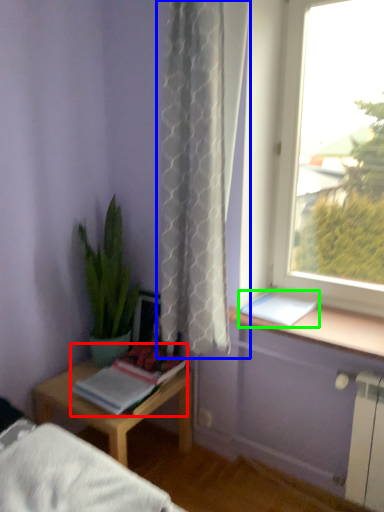
Question: Considering the real-world distances, which object is farthest from book (highlighted by a red box)? curtain (highlighted by a blue box) or book (highlighted by a green box)?

Choices:
 (A) curtain
 (B) book

Answer: (A)